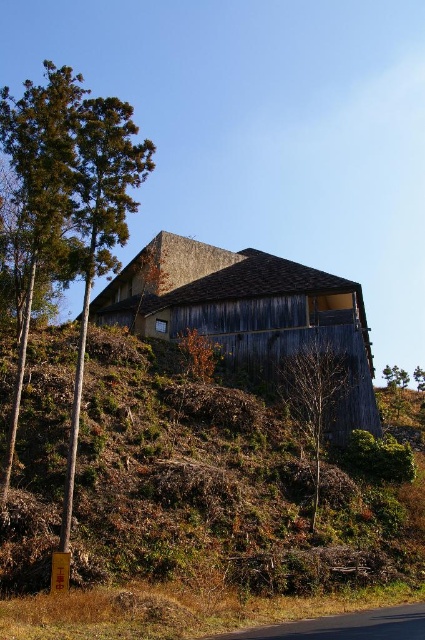
Question: Is brown wood hillside at center to the left of bare wood tree at center from the viewer's perspective?

Choices:
 (A) yes
 (B) no

Answer: (A)

Question: Which point is closer to the camera?

Choices:
 (A) bare wood tree at center
 (B) green textured tree at left
 (C) weathered wood barn at center
 (D) brown wood hillside at center

Answer: (D)

Question: Which of the following is the farthest from the observer?

Choices:
 (A) (322, 358)
 (B) (82, 332)
 (C) (342, 500)

Answer: (A)

Question: Among these points, which one is farthest from the camera?

Choices:
 (A) (221, 454)
 (B) (198, 243)
 (C) (303, 392)

Answer: (B)

Question: Is weathered wood barn at center bigger than green textured tree at left?

Choices:
 (A) yes
 (B) no

Answer: (B)

Question: Is green textured tree at left positioned before bare wood tree at center?

Choices:
 (A) no
 (B) yes

Answer: (B)